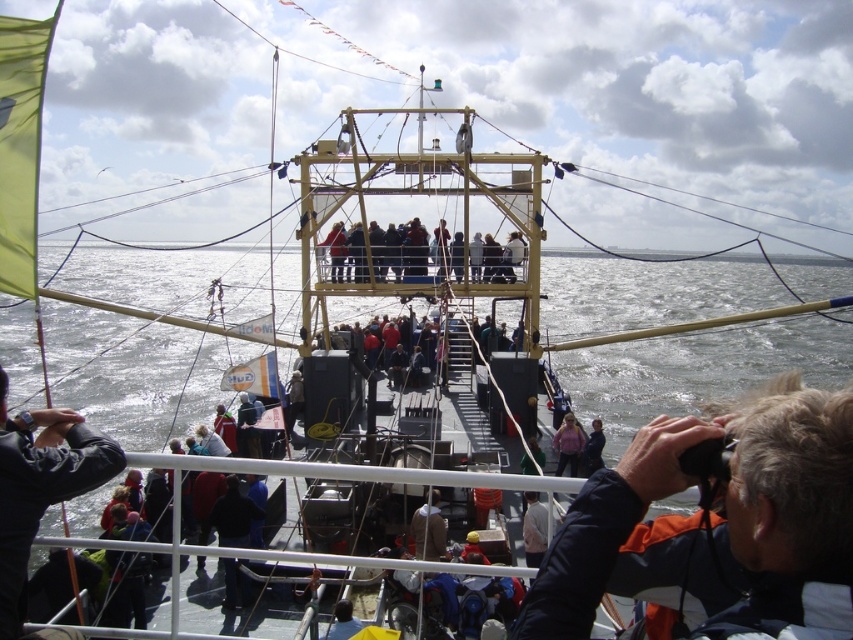
In the scene shown: Does dark blue jacket at lower right have a greater width compared to light brown wooden deck at center?

No.

Describe the element at coordinates (718, 525) in the screenshot. I see `dark blue jacket at lower right` at that location.

Identify the location of dark blue jacket at lower right. This screenshot has width=853, height=640. (718, 525).

Between light brown wooden deck at center and brown leather jacket at center, which one has more height?

light brown wooden deck at center

Between light brown wooden deck at center and brown leather jacket at center, which one is positioned lower?

brown leather jacket at center is lower down.

Is point (416, 257) less distant than point (434, 499)?

No, (416, 257) is further to viewer.

This screenshot has width=853, height=640. Identify the location of light brown wooden deck at center. (398, 250).

Between dark blue jacket at lower right and brown leather jacket at center, which one has less height?

brown leather jacket at center is shorter.

Does dark blue jacket at lower right have a lesser width compared to brown leather jacket at center?

No, dark blue jacket at lower right is not thinner than brown leather jacket at center.

You are a GUI agent. You are given a task and a screenshot of the screen. Output one action in this format:
    pyautogui.click(x=<x>, y=<y>)
    Task: Click on the dark blue jacket at lower right
    This screenshot has height=640, width=853.
    Given the screenshot: What is the action you would take?
    pyautogui.click(x=718, y=525)